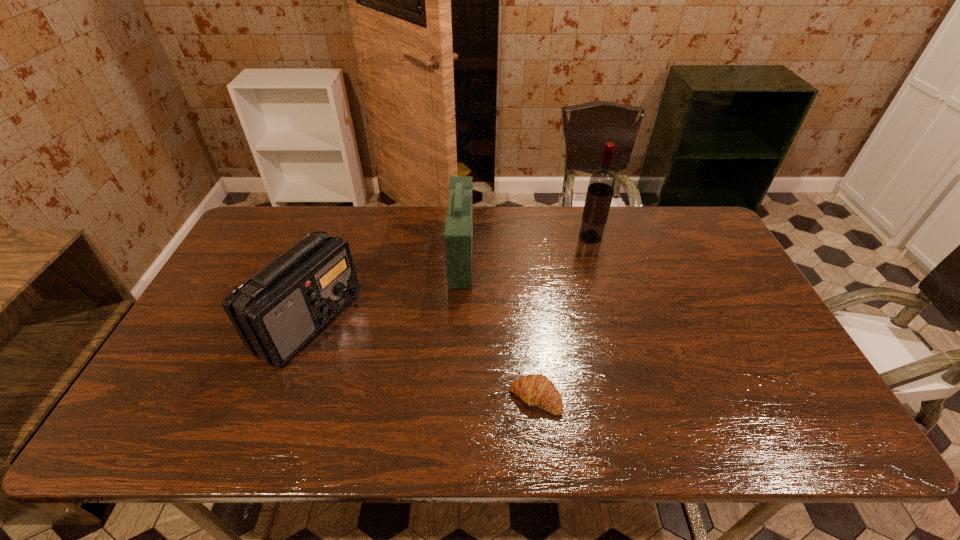
Locate an element on the screen. wine bottle at the far edge is located at coordinates point(601,186).

You are a GUI agent. You are given a task and a screenshot of the screen. Output one action in this format:
    pyautogui.click(x=<x>, y=<y>)
    Task: Click on the first-aid kit at the far edge
    This screenshot has width=960, height=540.
    Given the screenshot: What is the action you would take?
    pyautogui.click(x=458, y=235)

At what (x,y) coordinates should I click in order to perform the action: click on object that is positioned at the near edge. Please return your answer as a coordinate pair (x, y). Looking at the image, I should click on (536, 390).

You are a GUI agent. You are given a task and a screenshot of the screen. Output one action in this format:
    pyautogui.click(x=<x>, y=<y>)
    Task: Click on the free spot at the far edge of the desktop
    Image resolution: width=960 pixels, height=540 pixels.
    Given the screenshot: What is the action you would take?
    pyautogui.click(x=426, y=229)

You are a GUI agent. You are given a task and a screenshot of the screen. Output one action in this format:
    pyautogui.click(x=<x>, y=<y>)
    Task: Click on the blank space at the left edge
    This screenshot has height=540, width=960.
    Given the screenshot: What is the action you would take?
    pyautogui.click(x=254, y=274)

Locate an element on the screen. This screenshot has height=540, width=960. free space at the right edge of the desktop is located at coordinates (718, 332).

The image size is (960, 540). In the image, there is a desktop. Identify the location of free region at the far right corner. (667, 212).

What are the coordinates of `vacant space at the near right corner of the desktop` in the screenshot? It's located at (760, 416).

This screenshot has width=960, height=540. I want to click on vacant space that is in between the crescent roll and the rightmost object, so click(x=563, y=318).

The width and height of the screenshot is (960, 540). Find the location of `vacant space that is in between the third object from right to left and the third object from left to right`. vacant space that is in between the third object from right to left and the third object from left to right is located at coordinates (498, 327).